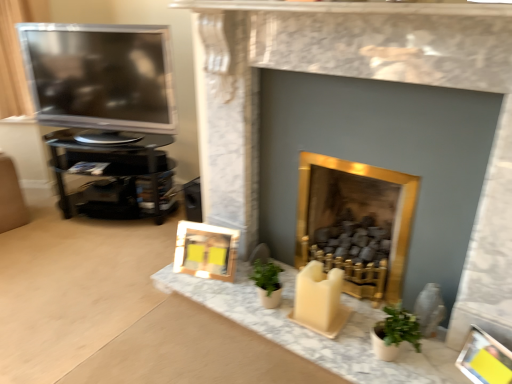
Find the location of a particular element. This screenshot has width=512, height=384. free spot in front of wooden frame at lower center, which appears as the 1th picture frame when viewed from the left is located at coordinates (211, 288).